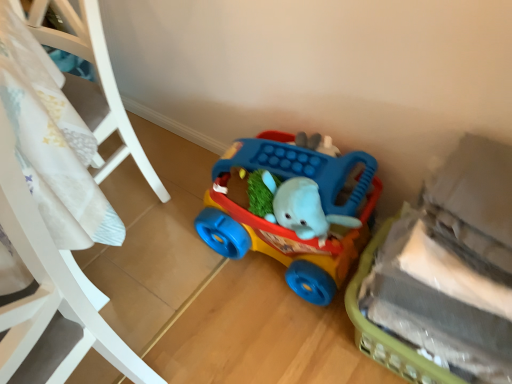
Find the location of a particular element. free spot above rubberized plastic walker at center, the first toy when ordered from back to front (from a real-world perspective) is located at coordinates click(272, 202).